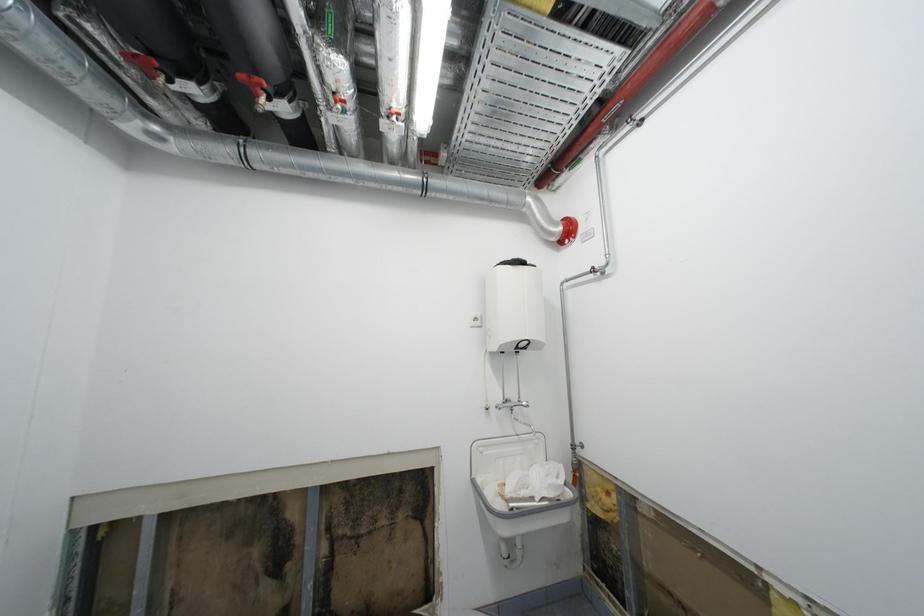
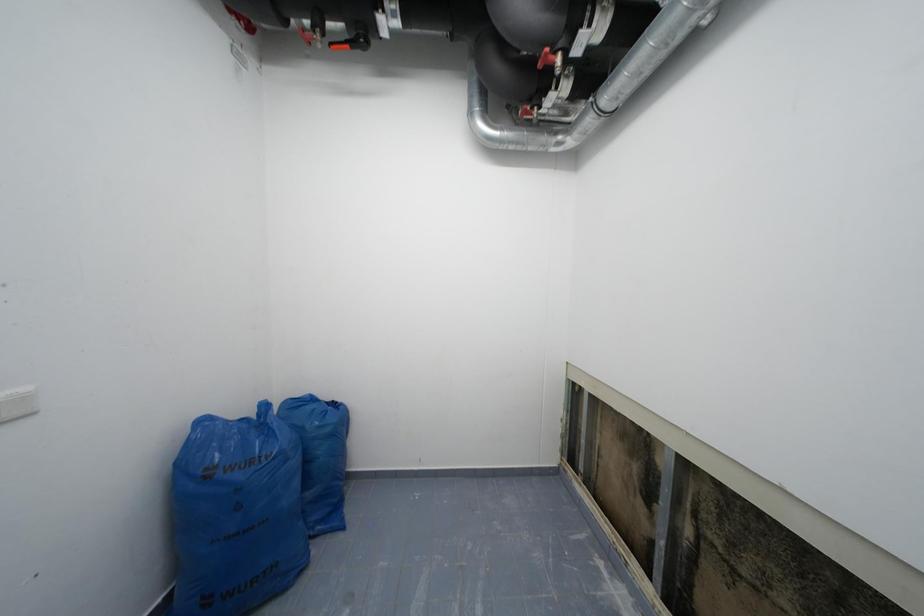
Question: Based on the continuous images, in which direction is the camera rotating? Reply with the corresponding letter.

Choices:
 (A) Left
 (B) Right
 (C) Up
 (D) Down

Answer: (A)